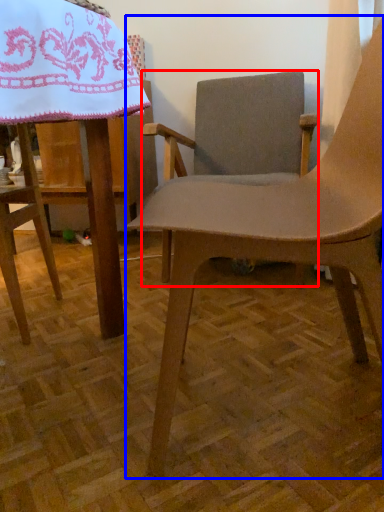
Question: Which object appears farthest to the camera in this image, chair (highlighted by a red box) or chair (highlighted by a blue box)?

Choices:
 (A) chair
 (B) chair

Answer: (A)